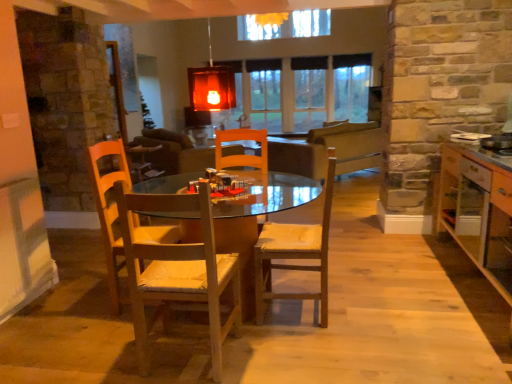
Question: In terms of size, does wooden chair at center, marked as the second chair in a right-to-left arrangement, appear bigger or smaller than clear glass window at center?

Choices:
 (A) small
 (B) big

Answer: (A)

Question: In terms of height, does wooden chair at center, the first chair viewed from the left, look taller or shorter compared to clear glass window at center?

Choices:
 (A) tall
 (B) short

Answer: (B)

Question: Considering the real-world distances, which object is farthest from the matte glass lampshade at upper center?

Choices:
 (A) wooden chair with cushion at center, positioned as the 1th chair in right-to-left order
 (B) wooden table at center
 (C) wooden cabinet at right
 (D) wooden chair at center, marked as the second chair in a right-to-left arrangement
 (E) clear glass window at center

Answer: (E)

Question: Which of these objects is positioned closest to the wooden chair at center, marked as the second chair in a right-to-left arrangement?

Choices:
 (A) wooden cabinet at right
 (B) matte glass lampshade at upper center
 (C) wooden table at center
 (D) clear glass window at center
 (E) wooden chair with cushion at center, positioned as the 1th chair in right-to-left order

Answer: (E)